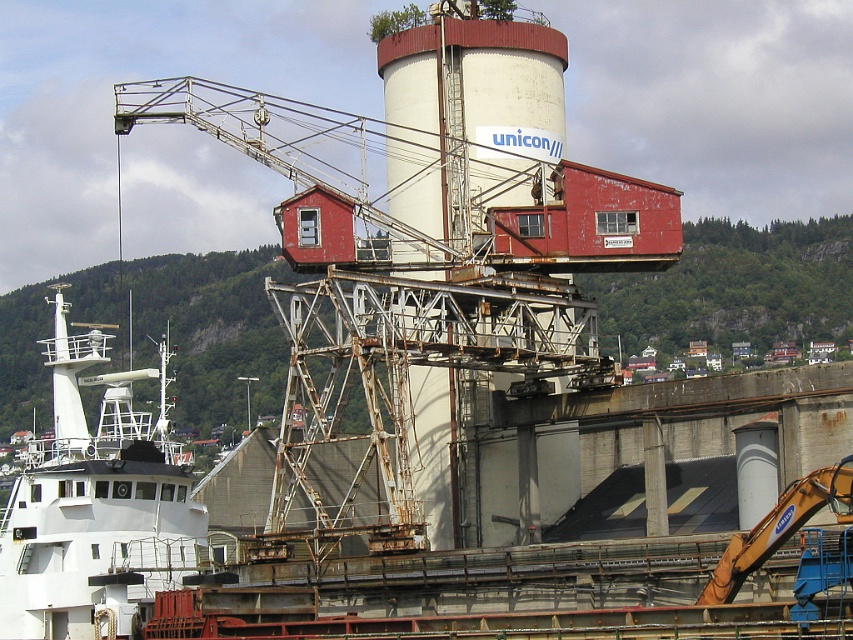
Question: Can you confirm if white matte tower at center is smaller than white matte boat at lower left?

Choices:
 (A) no
 (B) yes

Answer: (B)

Question: Which of the following is the closest to the observer?

Choices:
 (A) (x=149, y=502)
 (B) (x=392, y=104)

Answer: (A)

Question: Which object is farther from the camera taking this photo?

Choices:
 (A) white matte tower at center
 (B) white matte boat at lower left

Answer: (A)

Question: Which point is farther from the camera taking this photo?

Choices:
 (A) (173, 547)
 (B) (457, 84)

Answer: (B)

Question: Is white matte tower at center to the right of white matte boat at lower left from the viewer's perspective?

Choices:
 (A) no
 (B) yes

Answer: (B)

Question: Can you confirm if white matte tower at center is positioned above white matte boat at lower left?

Choices:
 (A) yes
 (B) no

Answer: (A)